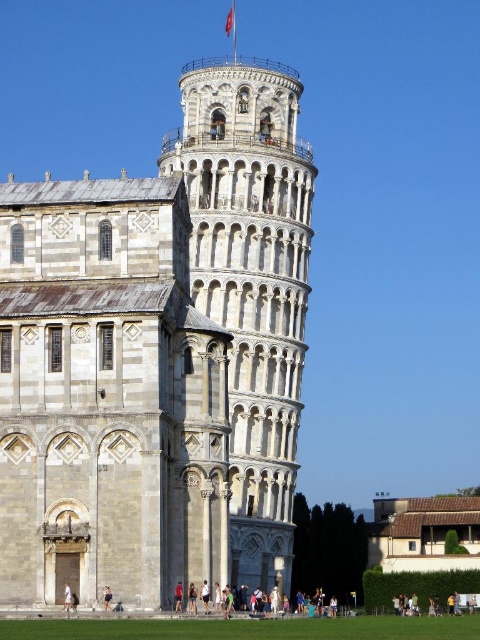
You are a tourist visiting the Leaning Tower of Pisa and see the white stone tower at center and the white fabric person at lower left. Which object is closer to you?

The white fabric person at lower left is behind the white stone tower at center, so the white stone tower at center is closer to you.

You are visiting the Leaning Tower of Pisa and want to sit down to take a photo. You see a light brown wooden bench at lower center and skinny jeans at center. Which object is positioned to the right from your perspective?

The light brown wooden bench at lower center is to the right of the skinny jeans at center.

You are standing at the point marked by coordinates point (158, 355) and want to take a photo of the white stone tower at center. Is the tower visible from your current position?

The white stone tower at center is represented by point (158, 355), so you are standing at the same location as the tower. Therefore, you cannot see the tower from that position.